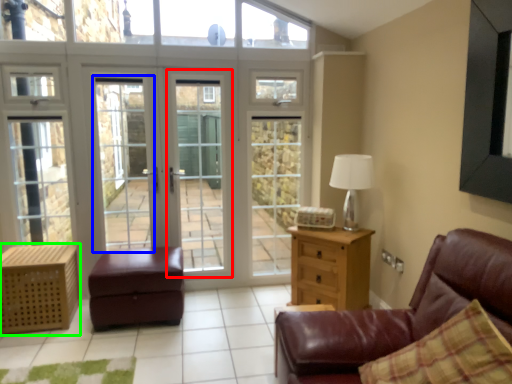
Question: Which is farther away from screen door (highlighted by a red box)? screen door (highlighted by a blue box) or nightstand (highlighted by a green box)?

Choices:
 (A) screen door
 (B) nightstand

Answer: (B)